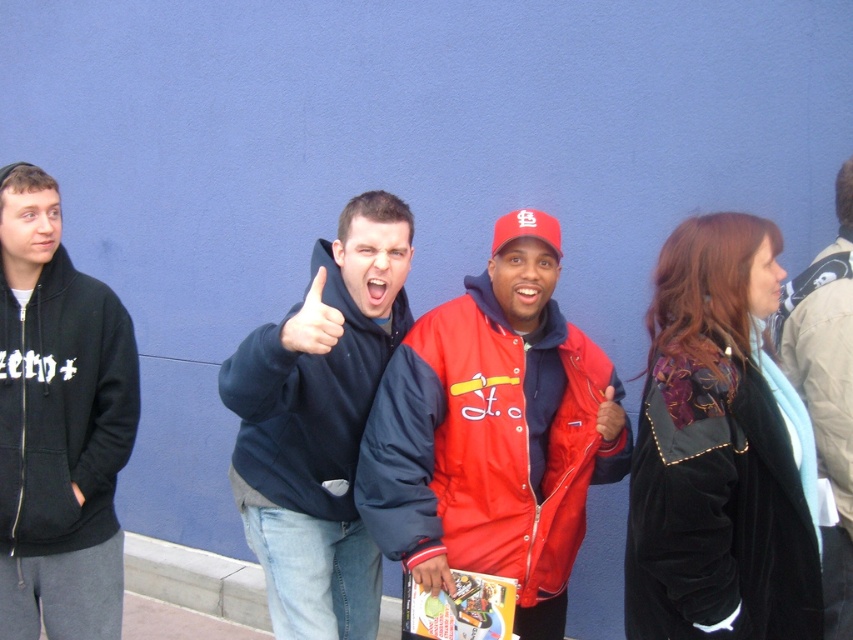
This screenshot has width=853, height=640. I want to click on red nylon jacket at center, so click(x=495, y=429).

In the scene shown: Is red nylon jacket at center smaller than black zip-up hoodie at left?

No.

Which is in front, point (561, 522) or point (80, 481)?

Point (80, 481)

Where is `red nylon jacket at center`? red nylon jacket at center is located at coordinates (495, 429).

Does black zip-up hoodie at left have a lesser height compared to velvet black sweatshirt at right?

No.

Is black zip-up hoodie at left bigger than velvet black sweatshirt at right?

No.

Identify the location of black zip-up hoodie at left. The width and height of the screenshot is (853, 640). (57, 424).

Can you confirm if red nylon jacket at center is positioned above velvet black sweatshirt at right?

Indeed, red nylon jacket at center is positioned over velvet black sweatshirt at right.

Which is behind, point (554, 492) or point (769, 554)?

Positioned behind is point (554, 492).

Is point (529, 380) less distant than point (709, 547)?

No, it is behind (709, 547).

This screenshot has width=853, height=640. In order to click on red nylon jacket at center in this screenshot , I will do `click(495, 429)`.